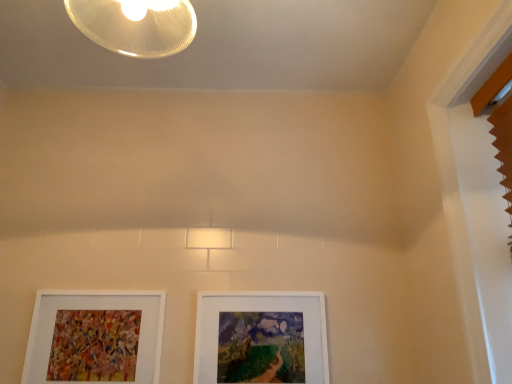
Question: In the image, is white matte picture frame at lower left, which is counted as the 1th picture frame, starting from the left, positioned in front of or behind white matte picture frame at center, marked as the 2th picture frame in a left-to-right arrangement?

Choices:
 (A) front
 (B) behind

Answer: (A)

Question: From a real-world perspective, is white matte picture frame at lower left, which is counted as the 1th picture frame, starting from the left, positioned above or below white matte picture frame at center, marked as the 1th picture frame in a right-to-left arrangement?

Choices:
 (A) below
 (B) above

Answer: (A)

Question: From their relative heights in the image, would you say white matte picture frame at lower left, the second picture frame from the right, is taller or shorter than white matte picture frame at center, marked as the 1th picture frame in a right-to-left arrangement?

Choices:
 (A) short
 (B) tall

Answer: (B)

Question: Is white matte picture frame at center, marked as the 2th picture frame in a left-to-right arrangement, wider or thinner than white matte picture frame at lower left, the second picture frame from the right?

Choices:
 (A) thin
 (B) wide

Answer: (B)

Question: From the image's perspective, is white matte picture frame at center, marked as the 2th picture frame in a left-to-right arrangement, positioned above or below white matte picture frame at lower left, the second picture frame from the right?

Choices:
 (A) below
 (B) above

Answer: (A)

Question: Which is correct: white matte picture frame at center, marked as the 2th picture frame in a left-to-right arrangement, is inside white matte picture frame at lower left, which is counted as the 1th picture frame, starting from the left, or outside of it?

Choices:
 (A) inside
 (B) outside

Answer: (B)

Question: Does point (262, 344) appear closer or farther from the camera than point (122, 299)?

Choices:
 (A) closer
 (B) farther

Answer: (A)